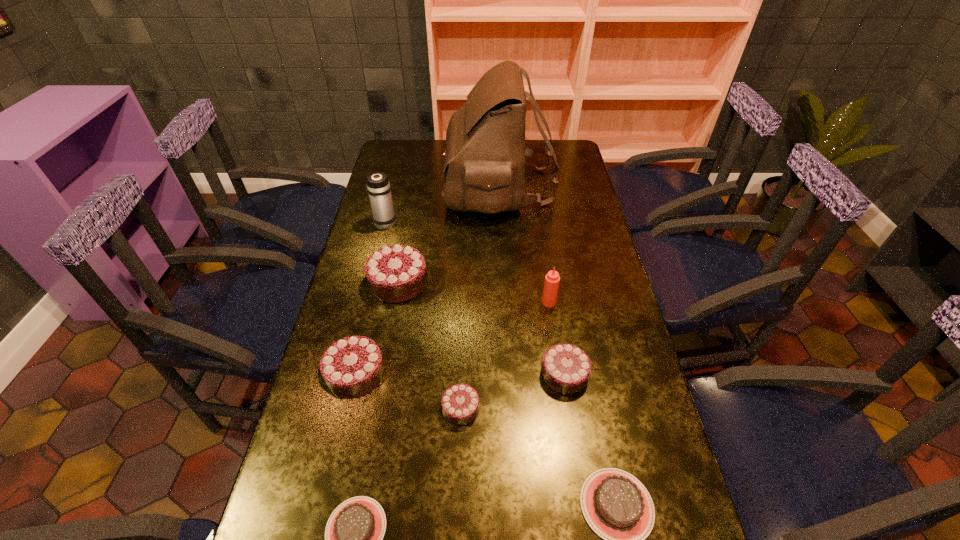
The image size is (960, 540). I want to click on the third shortest object, so click(481, 481).

Image resolution: width=960 pixels, height=540 pixels. Identify the location of the smallest chocolate chocolate cake. (481, 481).

Where is `free spot located 0.080m on the front flap of the brown satchel`? free spot located 0.080m on the front flap of the brown satchel is located at coordinates [x=424, y=187].

This screenshot has height=540, width=960. I want to click on free space located on the front flap of the brown satchel, so click(404, 187).

The image size is (960, 540). What are the coordinates of `vacant space located on the front flap of the brown satchel` in the screenshot? It's located at click(x=391, y=187).

Identify the location of blank area located 0.320m on the side with the handle of the thermos bottle. The height and width of the screenshot is (540, 960). (398, 167).

Find the location of a particular element. This screenshot has width=960, height=540. vacant space located 0.090m on the side with the handle of the thermos bottle is located at coordinates (391, 199).

The width and height of the screenshot is (960, 540). Find the location of `vacant area located on the side with the handle of the thermos bottle`. vacant area located on the side with the handle of the thermos bottle is located at coordinates (391, 202).

At what (x,y) coordinates should I click in order to perform the action: click on free region located 0.140m on the back of the seventh shortest object. Please return your answer as a coordinate pair (x, y). Image resolution: width=960 pixels, height=540 pixels. Looking at the image, I should click on (543, 265).

You are a GUI agent. You are given a task and a screenshot of the screen. Output one action in this format:
    pyautogui.click(x=<x>, y=<y>)
    Task: Click on the free space located on the back of the farthest chocolate cake
    The height and width of the screenshot is (540, 960).
    Given the screenshot: What is the action you would take?
    pyautogui.click(x=409, y=226)